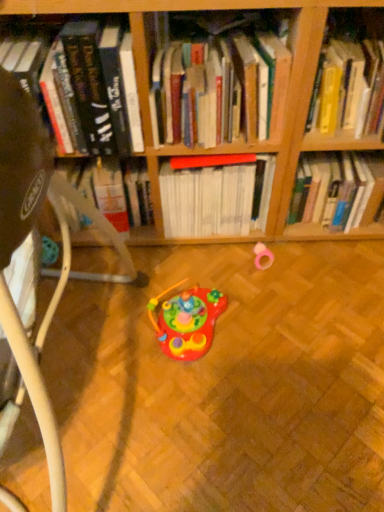
The image size is (384, 512). In order to click on free spot to the left of pink rubber ring at center right, which is counted as the first toy, starting from the back in this screenshot , I will do `click(226, 264)`.